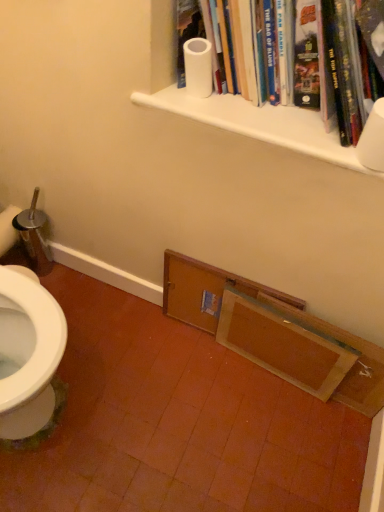
Question: Is white matte toilet paper at upper right, which ranks as the 1th toilet paper in right-to-left order, wider or thinner than white matte toilet paper at upper center, the second toilet paper positioned from the right?

Choices:
 (A) thin
 (B) wide

Answer: (B)

Question: Is point (380, 161) closer or farther from the camera than point (188, 91)?

Choices:
 (A) farther
 (B) closer

Answer: (B)

Question: Considering the real-world distances, which object is farthest from the white matte toilet paper at upper right, which ranks as the second toilet paper in left-to-right order?

Choices:
 (A) wooden frame at lower center
 (B) white matte shelf at upper center, placed as the first shelf when sorted from top to bottom
 (C) wooden door at lower center, acting as the second shelf starting from the top
 (D) white matte toilet paper at upper center, the second toilet paper positioned from the right
 (E) white matte paper towel roll at upper center

Answer: (C)

Question: Which of these objects is positioned farthest from the wooden door at lower center, acting as the second shelf starting from the top?

Choices:
 (A) white matte paper towel roll at upper center
 (B) white matte toilet paper at upper right, the first toilet paper when ordered from front to back
 (C) wooden frame at lower center
 (D) white matte toilet paper at upper center, which is the 1th toilet paper in top-to-bottom order
 (E) white matte shelf at upper center, placed as the first shelf when sorted from top to bottom

Answer: (B)